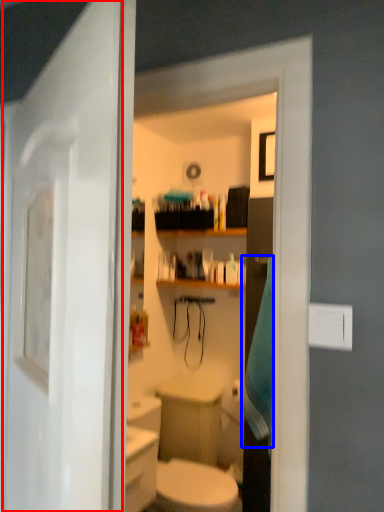
Question: Among these objects, which one is farthest to the camera, door (highlighted by a red box) or bath towel (highlighted by a blue box)?

Choices:
 (A) door
 (B) bath towel

Answer: (B)